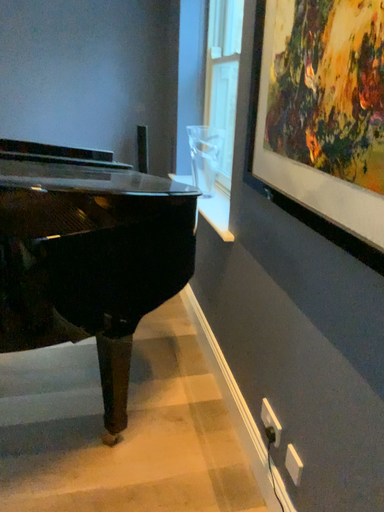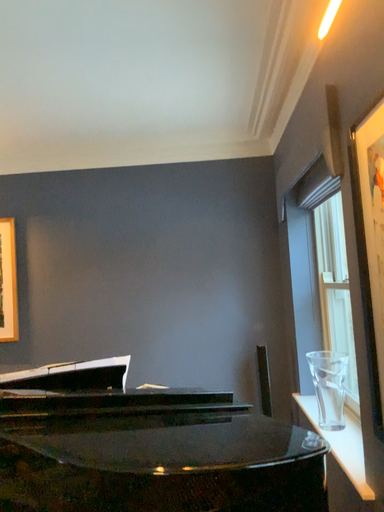
Question: How did the camera likely rotate when shooting the video?

Choices:
 (A) rotated right
 (B) rotated left

Answer: (B)